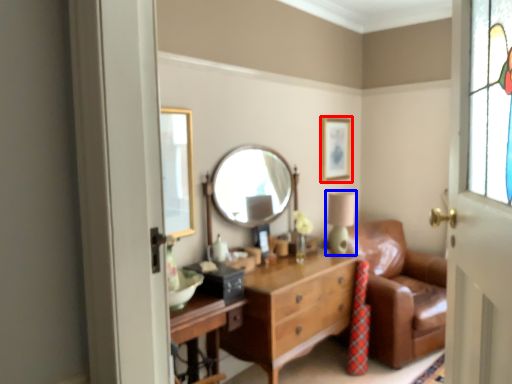
Question: Which object appears farthest to the camera in this image, picture frame (highlighted by a red box) or table lamp (highlighted by a blue box)?

Choices:
 (A) picture frame
 (B) table lamp

Answer: (A)